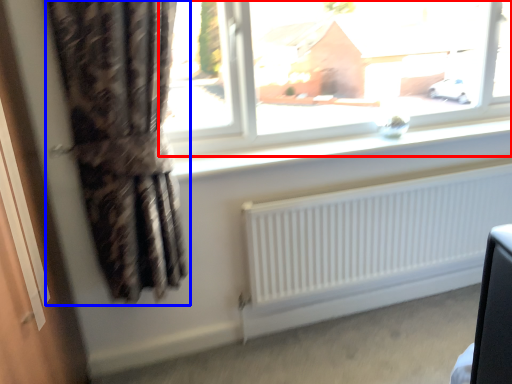
Question: Which point is further to the camera, window (highlighted by a red box) or curtain (highlighted by a blue box)?

Choices:
 (A) window
 (B) curtain

Answer: (A)